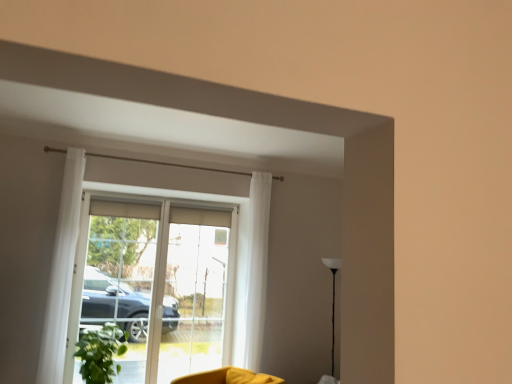
What is the approximate width of white sheer curtain at center, the 1th curtain positioned from the right?

It is 10.83 inches.

In the scene shown: How much space does transparent glass screen door at center, which is counted as the 2th screen door, starting from the left, occupy horizontally?

transparent glass screen door at center, which is counted as the 2th screen door, starting from the left, is 4.94 inches in width.

The width and height of the screenshot is (512, 384). What do you see at coordinates (100, 353) in the screenshot?
I see `green matte plant at lower left` at bounding box center [100, 353].

Describe the element at coordinates (131, 280) in the screenshot. The width and height of the screenshot is (512, 384). I see `translucent glass screen door at center, which is the second screen door from right to left` at that location.

You are a GUI agent. You are given a task and a screenshot of the screen. Output one action in this format:
    pyautogui.click(x=<x>, y=<y>)
    Task: Click on the white sheer curtain at center, which is counted as the 2th curtain, starting from the front
    This screenshot has height=384, width=512.
    Given the screenshot: What is the action you would take?
    pyautogui.click(x=257, y=268)

Is translucent glass screen door at center, acting as the first screen door starting from the left, oriented towards white sheer curtain at left, which appears as the first curtain when viewed from the left?

Yes, translucent glass screen door at center, acting as the first screen door starting from the left, faces towards white sheer curtain at left, which appears as the first curtain when viewed from the left.

Based on their sizes in the image, would you say translucent glass screen door at center, acting as the first screen door starting from the left, is bigger or smaller than white sheer curtain at left, which is the 2th curtain from back to front?

translucent glass screen door at center, acting as the first screen door starting from the left, is bigger than white sheer curtain at left, which is the 2th curtain from back to front.

From a real-world perspective, is translucent glass screen door at center, which is the second screen door from right to left, positioned over white sheer curtain at left, placed as the first curtain when sorted from front to back, based on gravity?

Incorrect, from a real-world perspective, translucent glass screen door at center, which is the second screen door from right to left, is lower than white sheer curtain at left, placed as the first curtain when sorted from front to back.

Is point (119, 285) positioned before point (68, 241)?

That is False.

Does point (196, 239) appear closer or farther from the camera than point (137, 359)?

Point (196, 239) appears to be farther away from the viewer than point (137, 359).

Does transparent glass screen door at center, acting as the 1th screen door starting from the right, have a smaller size compared to translucent glass screen door at center, acting as the first screen door starting from the left?

Actually, transparent glass screen door at center, acting as the 1th screen door starting from the right, might be larger than translucent glass screen door at center, acting as the first screen door starting from the left.

How much distance is there between transparent glass screen door at center, which is counted as the 2th screen door, starting from the left, and translucent glass screen door at center, which is the second screen door from right to left?

transparent glass screen door at center, which is counted as the 2th screen door, starting from the left, is 35.28 centimeters away from translucent glass screen door at center, which is the second screen door from right to left.

Does transparent glass screen door at center, acting as the 1th screen door starting from the right, turn towards translucent glass screen door at center, acting as the first screen door starting from the left?

No, transparent glass screen door at center, acting as the 1th screen door starting from the right, does not turn towards translucent glass screen door at center, acting as the first screen door starting from the left.

Identify the location of swivel chair on the right of translucent glass screen door at center, which is the second screen door from right to left. (228, 377).

Is yellow fabric swivel chair at lower center inside the boundaries of translucent glass screen door at center, acting as the first screen door starting from the left, or outside?

yellow fabric swivel chair at lower center exists outside the volume of translucent glass screen door at center, acting as the first screen door starting from the left.

Is yellow fabric swivel chair at lower center closer to camera compared to translucent glass screen door at center, which is the second screen door from right to left?

Yes, yellow fabric swivel chair at lower center is in front of translucent glass screen door at center, which is the second screen door from right to left.

Are yellow fabric swivel chair at lower center and translucent glass screen door at center, acting as the first screen door starting from the left, located far from each other?

That's right, there is a large distance between yellow fabric swivel chair at lower center and translucent glass screen door at center, acting as the first screen door starting from the left.

From a real-world perspective, is white glossy floor lamp at right above or below yellow fabric swivel chair at lower center?

white glossy floor lamp at right is above yellow fabric swivel chair at lower center.

Is white glossy floor lamp at right positioned with its back to yellow fabric swivel chair at lower center?

No, white glossy floor lamp at right is not facing away from yellow fabric swivel chair at lower center.

Could yellow fabric swivel chair at lower center be considered to be inside white glossy floor lamp at right?

Definitely not — yellow fabric swivel chair at lower center is not inside white glossy floor lamp at right.

Identify the location of lamp on the right of yellow fabric swivel chair at lower center. The image size is (512, 384). (333, 302).

Consider the image. Looking at their sizes, would you say translucent glass screen door at center, which is the second screen door from right to left, is wider or thinner than white glossy floor lamp at right?

translucent glass screen door at center, which is the second screen door from right to left, is thinner than white glossy floor lamp at right.

From a real-world perspective, who is located lower, translucent glass screen door at center, which is the second screen door from right to left, or white glossy floor lamp at right?

white glossy floor lamp at right is physically lower.

Between translucent glass screen door at center, acting as the first screen door starting from the left, and white glossy floor lamp at right, which one has more height?

translucent glass screen door at center, acting as the first screen door starting from the left.

Could you tell me if translucent glass screen door at center, acting as the first screen door starting from the left, is turned towards white glossy floor lamp at right?

No.

Could yellow fabric swivel chair at lower center be considered to be inside transparent glass screen door at center, acting as the 1th screen door starting from the right?

No, transparent glass screen door at center, acting as the 1th screen door starting from the right, does not contain yellow fabric swivel chair at lower center.

The height and width of the screenshot is (384, 512). Find the location of `swivel chair that is under the transparent glass screen door at center, acting as the 1th screen door starting from the right (from a real-world perspective)`. swivel chair that is under the transparent glass screen door at center, acting as the 1th screen door starting from the right (from a real-world perspective) is located at coordinates point(228,377).

Is transparent glass screen door at center, acting as the 1th screen door starting from the right, aimed at yellow fabric swivel chair at lower center?

Yes, transparent glass screen door at center, acting as the 1th screen door starting from the right, is oriented towards yellow fabric swivel chair at lower center.

Based on the photo, from the image's perspective, would you say transparent glass screen door at center, acting as the 1th screen door starting from the right, is positioned over yellow fabric swivel chair at lower center?

Yes.

Find the location of a particular element. curtain on the right of green matte plant at lower left is located at coordinates (257, 268).

Could you tell me if green matte plant at lower left is facing white sheer curtain at center, which is counted as the 2th curtain, starting from the front?

No, green matte plant at lower left is not turned towards white sheer curtain at center, which is counted as the 2th curtain, starting from the front.

Does green matte plant at lower left have a smaller size compared to white sheer curtain at center, which is counted as the 2th curtain, starting from the front?

Actually, green matte plant at lower left might be larger than white sheer curtain at center, which is counted as the 2th curtain, starting from the front.

Which of these two, green matte plant at lower left or white sheer curtain at center, the 1th curtain positioned from the right, stands shorter?

green matte plant at lower left.

The width and height of the screenshot is (512, 384). I want to click on the 1st screen door counting from the right of the white sheer curtain at left, placed as the second curtain when sorted from right to left, so click(131, 280).

At what (x,y) coordinates should I click in order to perform the action: click on screen door that is above the transparent glass screen door at center, acting as the 1th screen door starting from the right (from the image's perspective). Please return your answer as a coordinate pair (x, y). The width and height of the screenshot is (512, 384). Looking at the image, I should click on (131, 280).

Which object lies nearer to the anchor point white glossy floor lamp at right, translucent glass screen door at center, which is the second screen door from right to left, or white sheer curtain at center, acting as the first curtain starting from the back?

white sheer curtain at center, acting as the first curtain starting from the back.

Looking at the image, which one is located further to green matte plant at lower left, white sheer curtain at left, placed as the second curtain when sorted from right to left, or white glossy floor lamp at right?

Among the two, white glossy floor lamp at right is located further to green matte plant at lower left.

Looking at the image, which one is located further to white sheer curtain at center, which is counted as the 2th curtain, starting from the front, white sheer curtain at left, which appears as the first curtain when viewed from the left, or transparent glass screen door at center, acting as the 1th screen door starting from the right?

Based on the image, white sheer curtain at left, which appears as the first curtain when viewed from the left, appears to be further to white sheer curtain at center, which is counted as the 2th curtain, starting from the front.

Looking at the image, which one is located further to transparent glass screen door at center, acting as the 1th screen door starting from the right, transparent glass door at center or green matte plant at lower left?

green matte plant at lower left lies further to transparent glass screen door at center, acting as the 1th screen door starting from the right, than the other object.

Considering their positions, is green matte plant at lower left positioned closer to white glossy floor lamp at right than yellow fabric swivel chair at lower center?

yellow fabric swivel chair at lower center lies closer to white glossy floor lamp at right than the other object.

Looking at the image, which one is located further to white sheer curtain at center, which is counted as the 2th curtain, starting from the front, yellow fabric swivel chair at lower center or translucent glass screen door at center, which is the second screen door from right to left?

The object further to white sheer curtain at center, which is counted as the 2th curtain, starting from the front, is translucent glass screen door at center, which is the second screen door from right to left.

When comparing their distances from transparent glass screen door at center, which is counted as the 2th screen door, starting from the left, does yellow fabric swivel chair at lower center or translucent glass screen door at center, which is the second screen door from right to left, seem further?

yellow fabric swivel chair at lower center is further to transparent glass screen door at center, which is counted as the 2th screen door, starting from the left.

From the image, which object appears to be farther from translucent glass screen door at center, which is the second screen door from right to left, transparent glass screen door at center, acting as the 1th screen door starting from the right, or white sheer curtain at left, which appears as the first curtain when viewed from the left?

white sheer curtain at left, which appears as the first curtain when viewed from the left, is positioned further to the anchor translucent glass screen door at center, which is the second screen door from right to left.

This screenshot has width=512, height=384. What are the coordinates of `window between white sheer curtain at left, which appears as the first curtain when viewed from the left, and transparent glass screen door at center, acting as the 1th screen door starting from the right` in the screenshot? It's located at [x=162, y=280].

You are a GUI agent. You are given a task and a screenshot of the screen. Output one action in this format:
    pyautogui.click(x=<x>, y=<y>)
    Task: Click on the window between white sheer curtain at left, placed as the first curtain when sorted from front to back, and white glossy floor lamp at right
    The image size is (512, 384).
    Given the screenshot: What is the action you would take?
    pyautogui.click(x=162, y=280)

Identify the location of swivel chair between white sheer curtain at left, placed as the second curtain when sorted from right to left, and white sheer curtain at center, the 1th curtain positioned from the right, from left to right. (228, 377).

Identify the location of window between green matte plant at lower left and white sheer curtain at center, the 1th curtain positioned from the right, in the horizontal direction. The height and width of the screenshot is (384, 512). (162, 280).